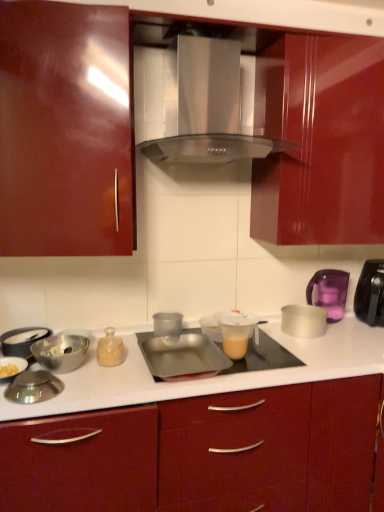
Question: Is shiny silver lid at lower left, the third appliance in the left-to-right sequence, situated inside transparent plastic cup at center, the 5th appliance when ordered from right to left, or outside?

Choices:
 (A) outside
 (B) inside

Answer: (A)

Question: Considering the positions of point (54, 390) and point (167, 311), is point (54, 390) closer or farther from the camera than point (167, 311)?

Choices:
 (A) farther
 (B) closer

Answer: (B)

Question: Based on their relative distances, which object is farther from the transparent plastic cup at center, the fourth appliance when ordered from left to right?

Choices:
 (A) metallic red cabinet at center, placed as the second cabinetry when sorted from top to bottom
 (B) metallic silver tray at center, the 4th appliance from the right
 (C) translucent plastic measuring cup at center, which is the second appliance in right-to-left order
 (D) metallic silver bowl at lower left, which appears as the 2th appliance when viewed from the left
 (E) translucent plastic cup at center, the sixth appliance when ordered from left to right

Answer: (D)

Question: Based on their relative distances, which object is nearer to the silver metallic bowl at left?

Choices:
 (A) metallic red cabinet at center, which is the 1th cabinetry in bottom-to-top order
 (B) glossy wood cabinet at upper center, positioned as the 1th cabinetry in top-to-bottom order
 (C) silver metallic bowl at right, the first appliance positioned from the right
 (D) shiny silver lid at lower left, positioned as the 6th appliance in right-to-left order
 (E) metallic silver bowl at lower left, which is the 7th appliance from right to left

Answer: (E)